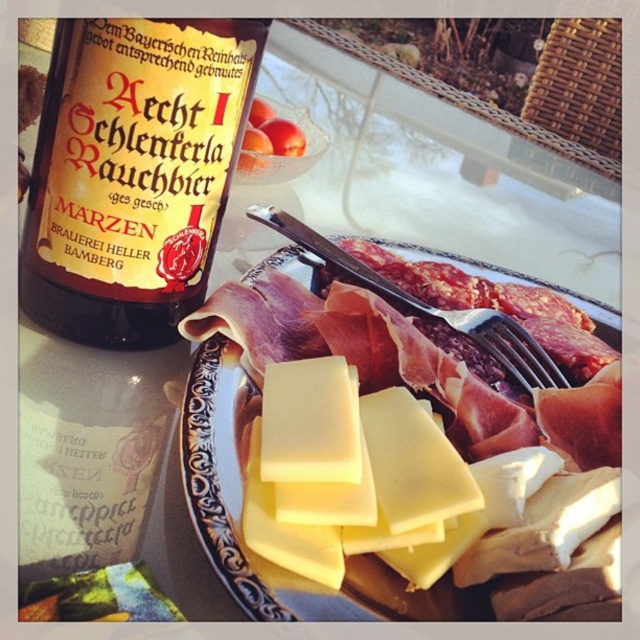
Does silver metallic fork at center have a larger size compared to dark red meat at center?

Correct, silver metallic fork at center is larger in size than dark red meat at center.

Is point (452, 330) positioned in front of point (413, 310)?

Yes.

This screenshot has width=640, height=640. I want to click on silver metallic fork at center, so click(429, 307).

Find the location of a particular element. The height and width of the screenshot is (640, 640). silver metallic fork at center is located at coordinates (429, 307).

Who is shorter, yellow cheese at center or yellow hard cheese at center?

yellow hard cheese at center

You are a GUI agent. You are given a task and a screenshot of the screen. Output one action in this format:
    pyautogui.click(x=<x>, y=<y>)
    Task: Click on the yellow cheese at center
    The image size is (640, 640).
    Given the screenshot: What is the action you would take?
    pyautogui.click(x=241, y=499)

Between yellow hard cheese at center and silver metallic fork at center, which one is positioned higher?

silver metallic fork at center is higher up.

Between yellow hard cheese at center and silver metallic fork at center, which one has less height?

Standing shorter between the two is yellow hard cheese at center.

Who is more forward, (284, 417) or (330, 250)?

Result: Point (284, 417) is in front.

At what (x,y) coordinates should I click in order to perform the action: click on yellow hard cheese at center. Please return your answer as a coordinate pair (x, y). Looking at the image, I should click on (308, 422).